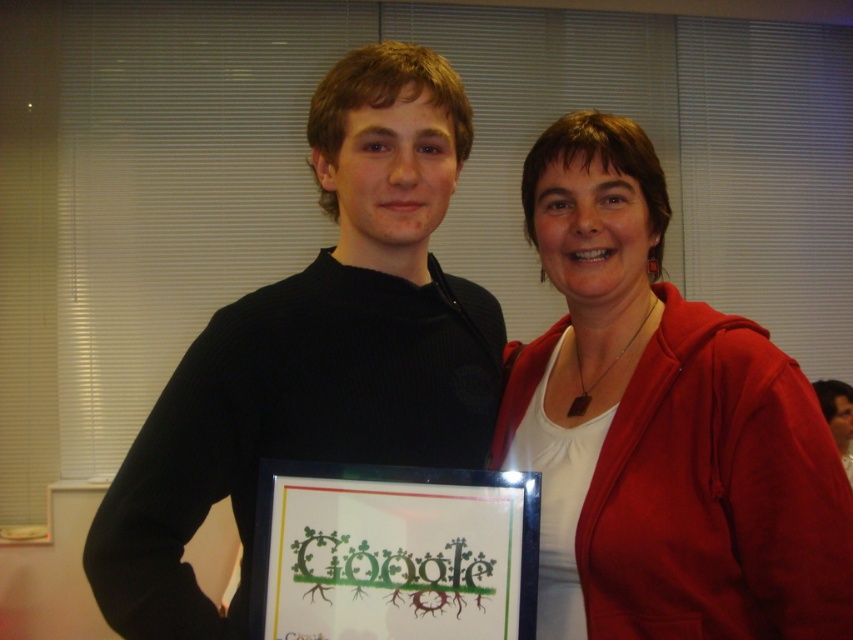
You are a photographer standing at the center of the room. You want to capture a clear photo of the white matte shirt at center without any blur. The camera you are using has a minimum focus distance of 40 inches. Can you take the photo from your current position?

The white matte shirt at center and viewer are 38.09 inches apart, which is less than the camera minimum focus distance of 40 inches. Therefore, you cannot take a clear photo without blur from your current position.

You are a photographer at the event and want to ensure that both the white matte shirt at center and the black framed picture at center are visible in the photo. Which object should be positioned closer to the left side of the frame to achieve this?

The black framed picture at center should be positioned closer to the left side of the frame because the white matte shirt at center is currently to the right of it. By moving the black framed picture to the left, both objects can be accommodated within the frame.